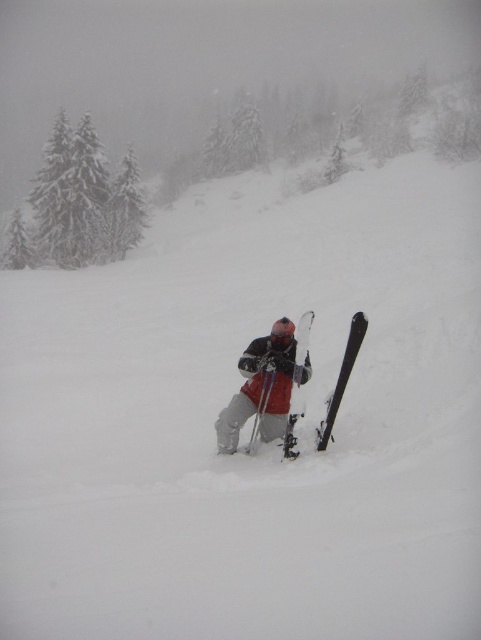
In the scene shown: Does matte gray ski suit at center appear over matte black ski at center?

Actually, matte gray ski suit at center is below matte black ski at center.

Who is lower down, matte gray ski suit at center or matte black ski at center?

matte gray ski suit at center

Does point (218, 436) lie in front of point (292, 438)?

No, (218, 436) is further to viewer.

Where is `matte gray ski suit at center`? This screenshot has width=481, height=640. matte gray ski suit at center is located at coordinates (264, 387).

Measure the distance between black matte ski at lower center and camera.

They are 9.00 meters apart.

Who is more forward, (333, 400) or (292, 388)?

Point (333, 400) is in front.

Which is in front, point (327, 417) or point (308, 326)?

Point (308, 326) is more forward.

This screenshot has height=640, width=481. In order to click on black matte ski at lower center in this screenshot , I will do `click(341, 378)`.

Which of these two, matte gray ski suit at center or black matte ski at lower center, stands shorter?

black matte ski at lower center

Is matte gray ski suit at center smaller than black matte ski at lower center?

No, matte gray ski suit at center is not smaller than black matte ski at lower center.

Is point (294, 380) positioned in front of point (353, 320)?

No, it is not.

Locate an element on the screen. Image resolution: width=481 pixels, height=640 pixels. matte gray ski suit at center is located at coordinates (264, 387).